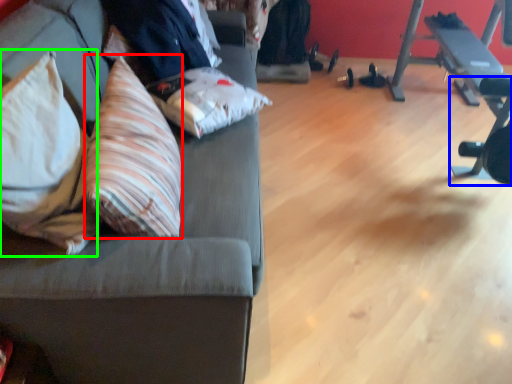
Question: Estimate the real-world distances between objects in this image. Which object is farther from throw pillow (highlighted by a red box), barbell (highlighted by a blue box) or throw pillow (highlighted by a green box)?

Choices:
 (A) barbell
 (B) throw pillow

Answer: (A)